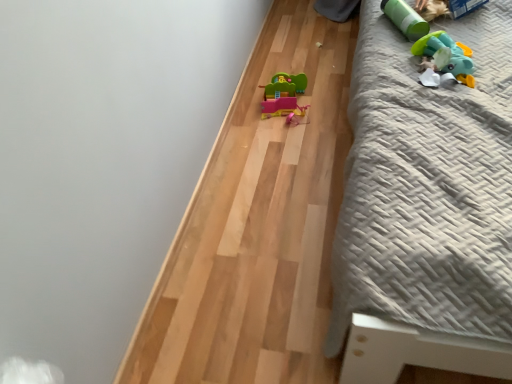
Locate an element on the screen. The width and height of the screenshot is (512, 384). free space behind matte plastic toy car at center, arranged as the third toy when viewed from the right is located at coordinates point(286,69).